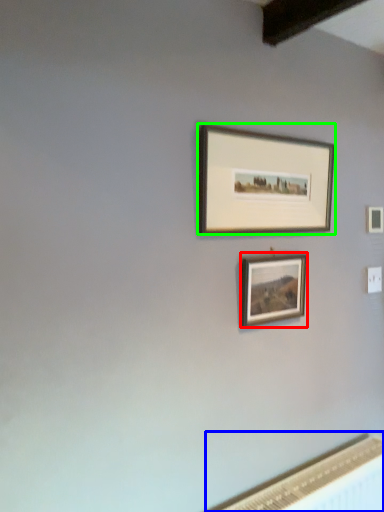
Question: Which object is the closest to the picture frame (highlighted by a red box)? Choose among these: radiator (highlighted by a blue box) or picture frame (highlighted by a green box).

Choices:
 (A) radiator
 (B) picture frame

Answer: (B)